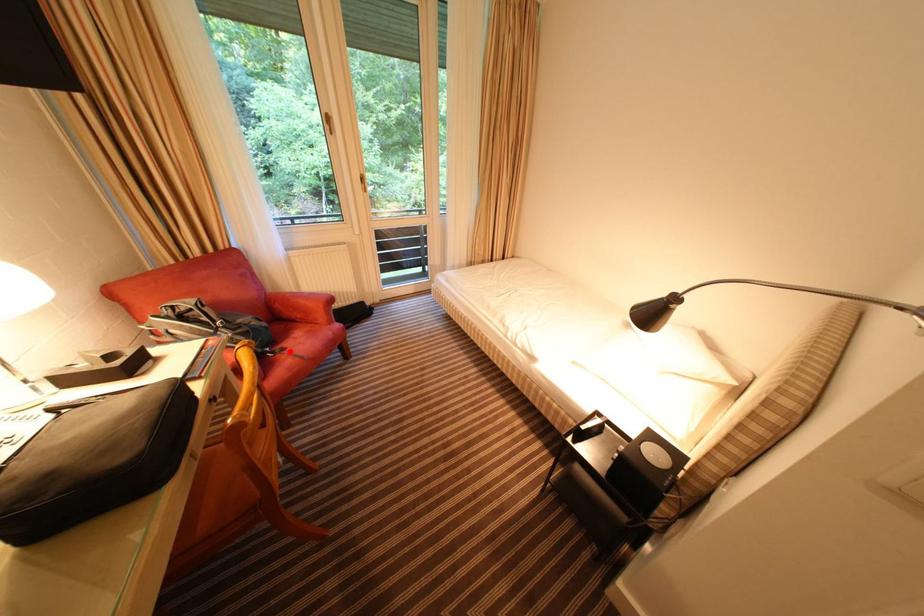
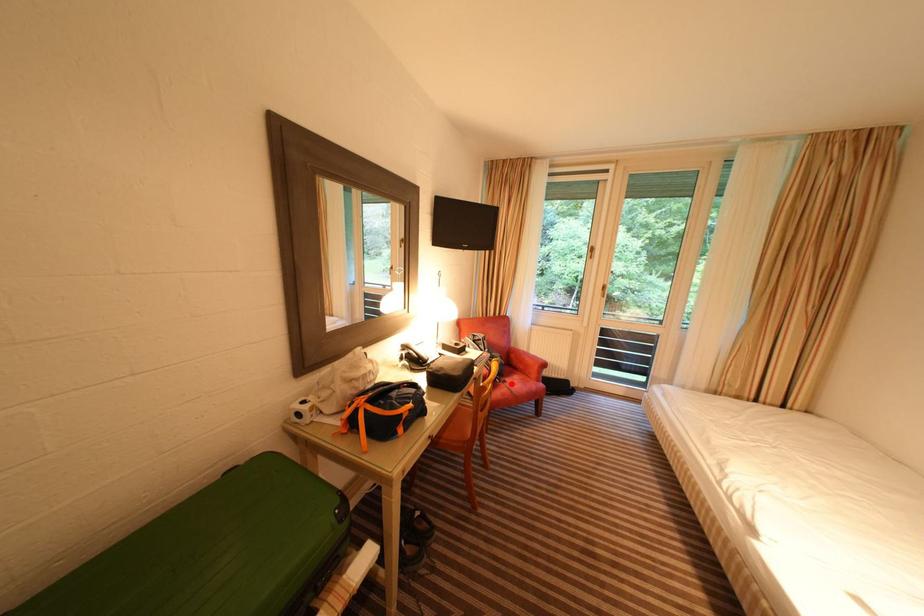
I am providing you with two images of the same scene from different viewpoints. A red point is marked on the first image and another point is marked on the second image. Is the marked point in image1 the same physical position as the marked point in image2?

Yes